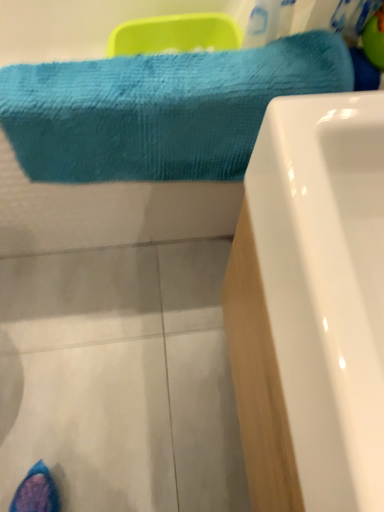
Question: Could you tell me if turquoise textured towel at upper left is turned towards white glossy bathtub at lower right?

Choices:
 (A) yes
 (B) no

Answer: (A)

Question: Is the surface of turquoise textured towel at upper left in direct contact with white glossy bathtub at lower right?

Choices:
 (A) no
 (B) yes

Answer: (A)

Question: Can you confirm if turquoise textured towel at upper left is shorter than white glossy bathtub at lower right?

Choices:
 (A) yes
 (B) no

Answer: (A)

Question: From a real-world perspective, is turquoise textured towel at upper left under white glossy bathtub at lower right?

Choices:
 (A) yes
 (B) no

Answer: (B)

Question: From the image's perspective, would you say turquoise textured towel at upper left is shown under white glossy bathtub at lower right?

Choices:
 (A) yes
 (B) no

Answer: (B)

Question: From the image's perspective, is turquoise textured towel at upper left on white glossy bathtub at lower right?

Choices:
 (A) no
 (B) yes

Answer: (B)

Question: Can you confirm if white glossy bathtub at lower right is wider than turquoise textured towel at upper left?

Choices:
 (A) yes
 (B) no

Answer: (B)

Question: Does white glossy bathtub at lower right have a greater height compared to turquoise textured towel at upper left?

Choices:
 (A) no
 (B) yes

Answer: (B)

Question: From a real-world perspective, is white glossy bathtub at lower right physically below turquoise textured towel at upper left?

Choices:
 (A) no
 (B) yes

Answer: (B)

Question: From the image's perspective, is white glossy bathtub at lower right below turquoise textured towel at upper left?

Choices:
 (A) no
 (B) yes

Answer: (B)

Question: Can you confirm if white glossy bathtub at lower right is bigger than turquoise textured towel at upper left?

Choices:
 (A) yes
 (B) no

Answer: (A)

Question: Could you tell me if white glossy bathtub at lower right is facing turquoise textured towel at upper left?

Choices:
 (A) yes
 (B) no

Answer: (B)

Question: Considering their positions, is turquoise textured towel at upper left located in front of or behind white glossy bathtub at lower right?

Choices:
 (A) front
 (B) behind

Answer: (B)